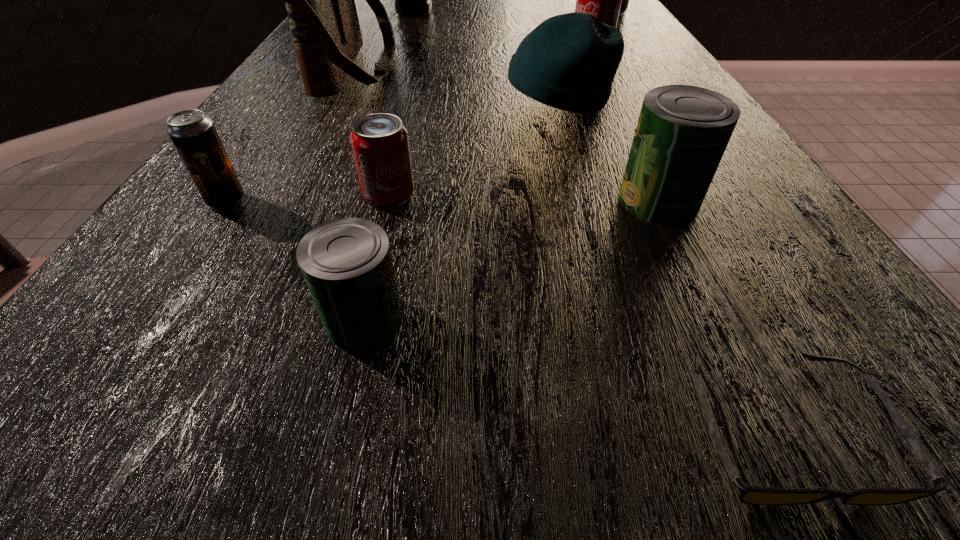
Identify the location of beer can. (194, 135).

I want to click on the nearer green can, so click(x=347, y=265).

This screenshot has width=960, height=540. Find the location of `the smaller green can`. the smaller green can is located at coordinates (347, 265).

The image size is (960, 540). Find the location of `the smallest red can`. the smallest red can is located at coordinates (380, 143).

The width and height of the screenshot is (960, 540). I want to click on the leftmost red can, so click(380, 143).

I want to click on the nearest object, so click(x=749, y=494).

At what (x,y) coordinates should I click in order to perform the action: click on sunglasses. Please return your answer as a coordinate pair (x, y). Image resolution: width=960 pixels, height=540 pixels. Looking at the image, I should click on (749, 494).

Locate an element on the screen. free region located 0.130m on the front-facing side of the black liquor is located at coordinates (478, 11).

You are a GUI agent. You are given a task and a screenshot of the screen. Output one action in this format:
    pyautogui.click(x=<x>, y=<y>)
    Task: Click on the vacant space located on the front-facing side of the shoulder bag
    
    Given the screenshot: What is the action you would take?
    pyautogui.click(x=428, y=69)

Locate an element on the screen. Image resolution: width=960 pixels, height=540 pixels. vacant space situated on the left of the biggest red can is located at coordinates (477, 11).